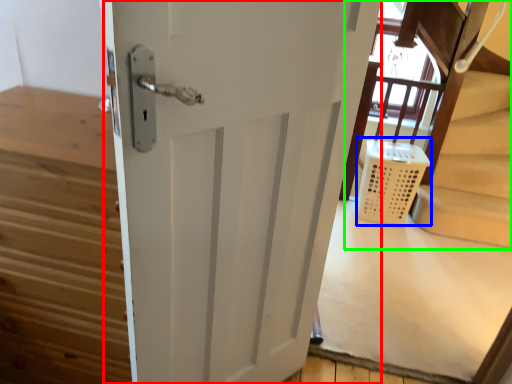
Question: Estimate the real-world distances between objects in this image. Which object is closer to door (highlighted by a red box), laundry basket (highlighted by a blue box) or bunk bed (highlighted by a green box)?

Choices:
 (A) laundry basket
 (B) bunk bed

Answer: (A)